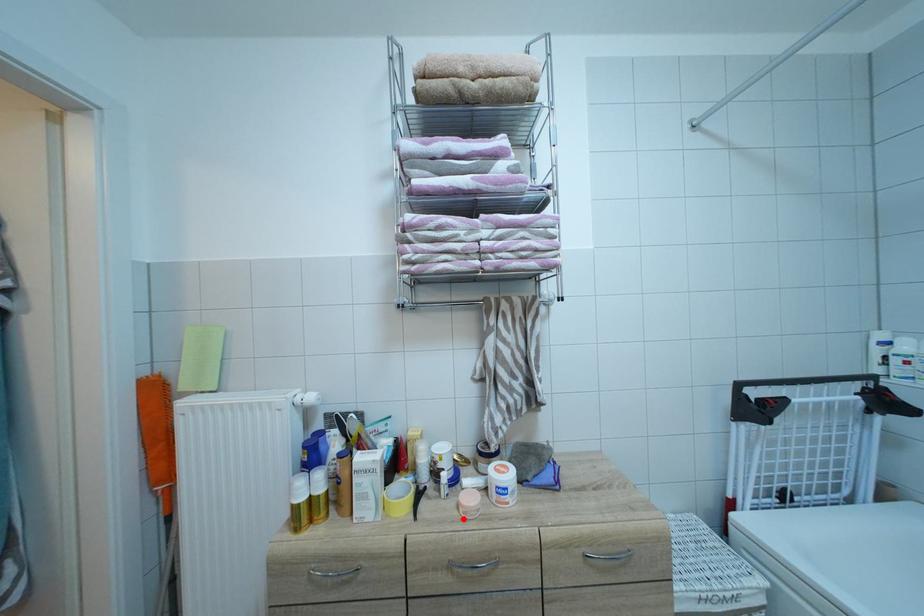
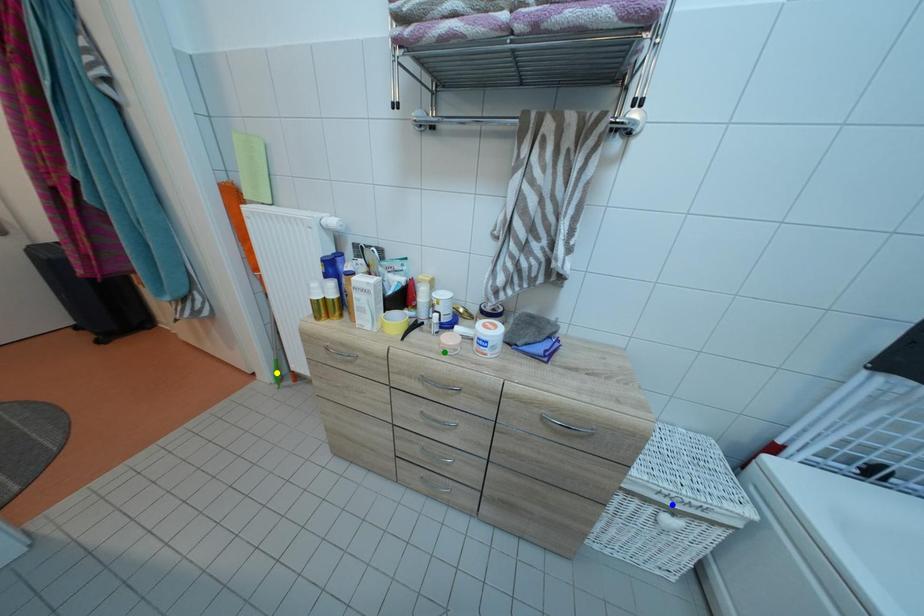
Question: I am providing you with two images of the same scene from different viewpoints. A red point is marked on the first image. You are given multiple points on the second image. Which spot in image 2 lines up with the point in image 1?

Choices:
 (A) green point
 (B) yellow point
 (C) blue point

Answer: (A)